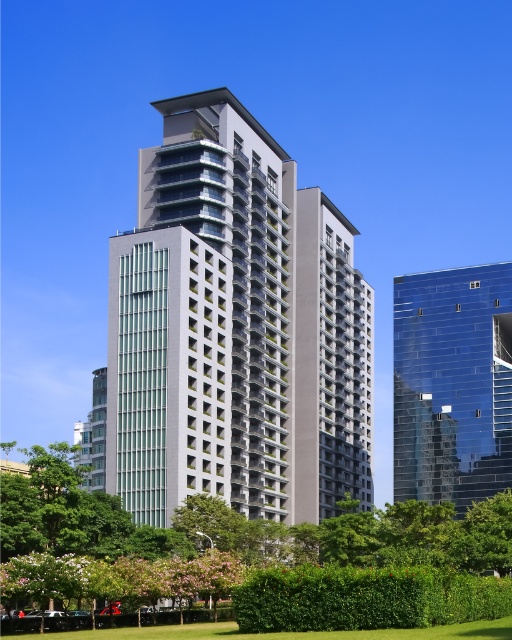
Question: Based on their relative distances, which object is nearer to the transparent glass building at right?

Choices:
 (A) green leafy park at center
 (B) white glass building at center
 (C) green grass at lower center

Answer: (B)

Question: Which object is closer to the camera taking this photo?

Choices:
 (A) transparent glass building at right
 (B) green leafy park at center
 (C) white glass building at center
 (D) green grass at lower center

Answer: (D)

Question: Does white glass building at center appear on the right side of green grass at lower center?

Choices:
 (A) yes
 (B) no

Answer: (B)

Question: Among these objects, which one is farthest from the camera?

Choices:
 (A) green grass at lower center
 (B) transparent glass building at right

Answer: (B)

Question: Does white glass building at center lie in front of green leafy park at center?

Choices:
 (A) yes
 (B) no

Answer: (B)

Question: Does transparent glass building at right appear under green grass at lower center?

Choices:
 (A) no
 (B) yes

Answer: (A)